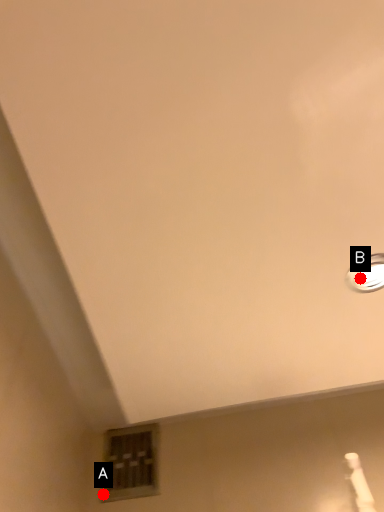
Question: Two points are circled on the image, labeled by A and B beside each circle. Which point is further to the camera?

Choices:
 (A) A is further
 (B) B is further

Answer: (A)